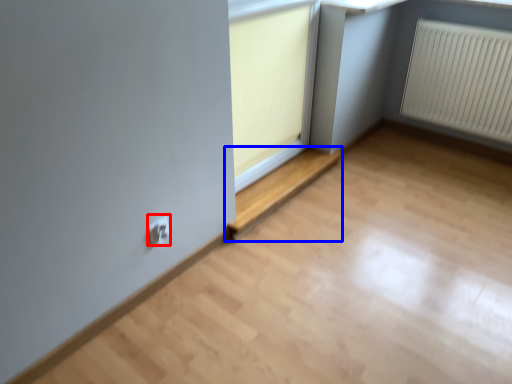
Question: Which object appears farthest to the camera in this image, electric outlet (highlighted by a red box) or window (highlighted by a blue box)?

Choices:
 (A) electric outlet
 (B) window

Answer: (B)